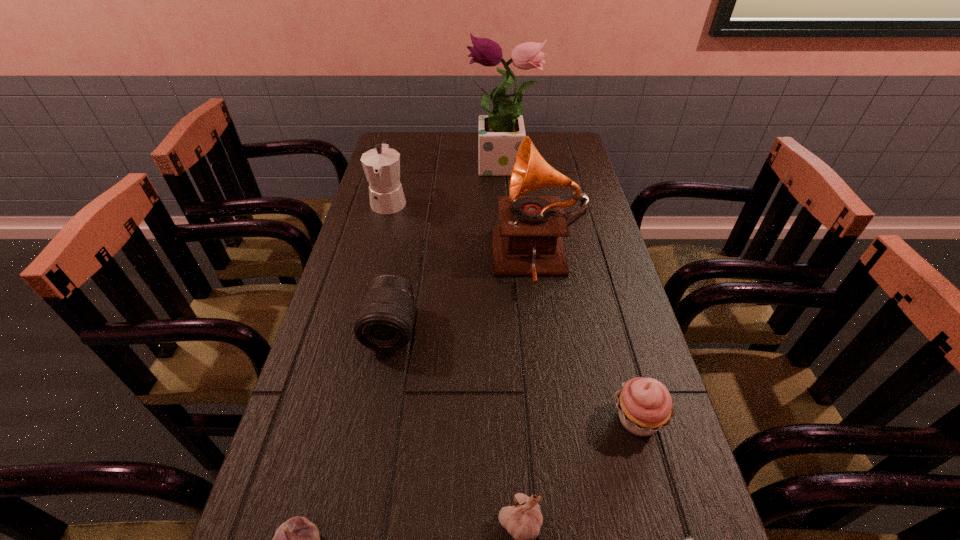
This screenshot has height=540, width=960. I want to click on flower arrangement, so click(501, 132).

Locate an element on the screen. This screenshot has height=540, width=960. phonograph record is located at coordinates (528, 240).

The image size is (960, 540). Identify the location of the sixth nearest object. (528, 240).

I want to click on coffeepot, so click(x=381, y=165).

Where is `telephoto lens`? The height and width of the screenshot is (540, 960). telephoto lens is located at coordinates click(384, 323).

Identify the location of the fifth farthest object. (645, 406).

Image resolution: width=960 pixels, height=540 pixels. In order to click on vacant position located 0.100m on the front-facing side of the tallest object in this screenshot , I will do `click(441, 168)`.

The image size is (960, 540). What are the coordinates of `free space located 0.200m on the front-facing side of the tallest object` in the screenshot? It's located at (412, 168).

What are the coordinates of `free space located on the front-facing side of the tallest object` in the screenshot? It's located at (398, 168).

The image size is (960, 540). I want to click on vacant space located on the horn of the sixth nearest object, so click(350, 261).